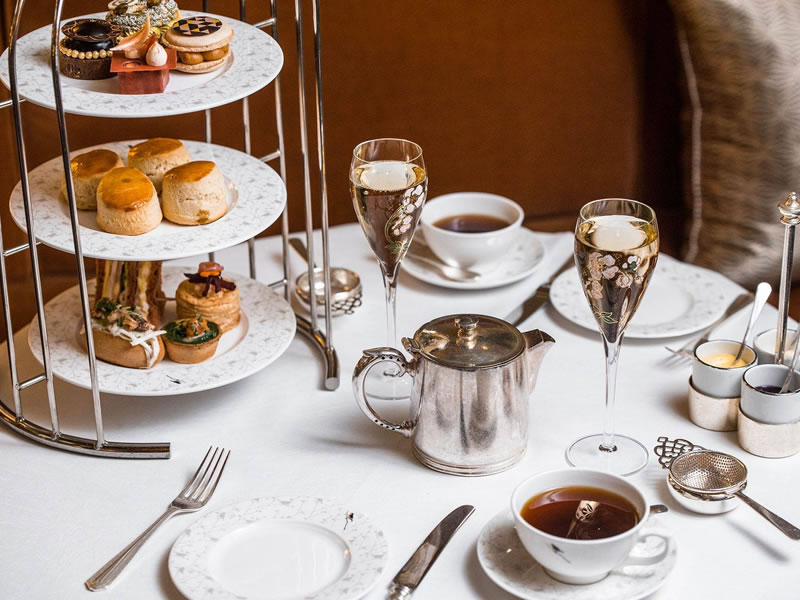
Find the location of a particular element. The width and height of the screenshot is (800, 600). table is located at coordinates (569, 380).